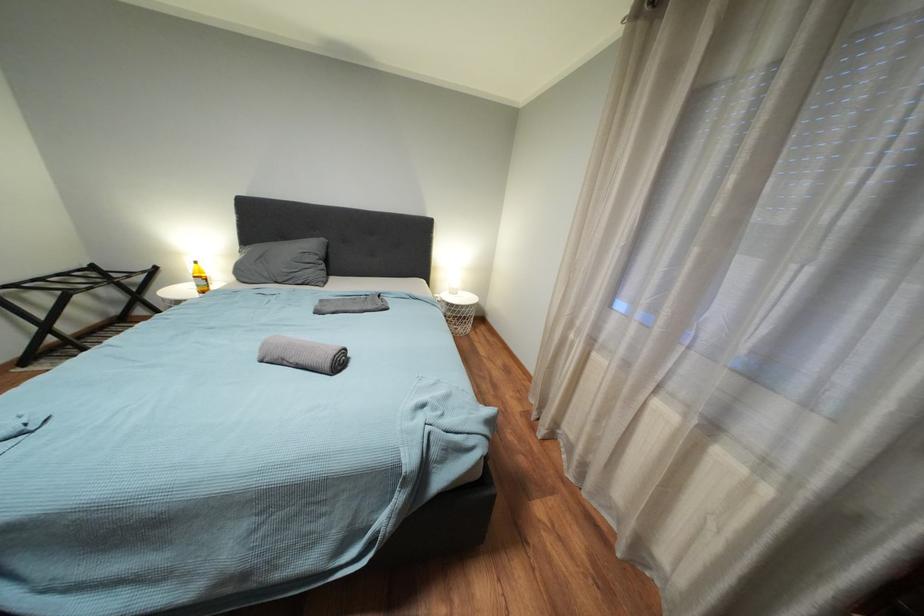
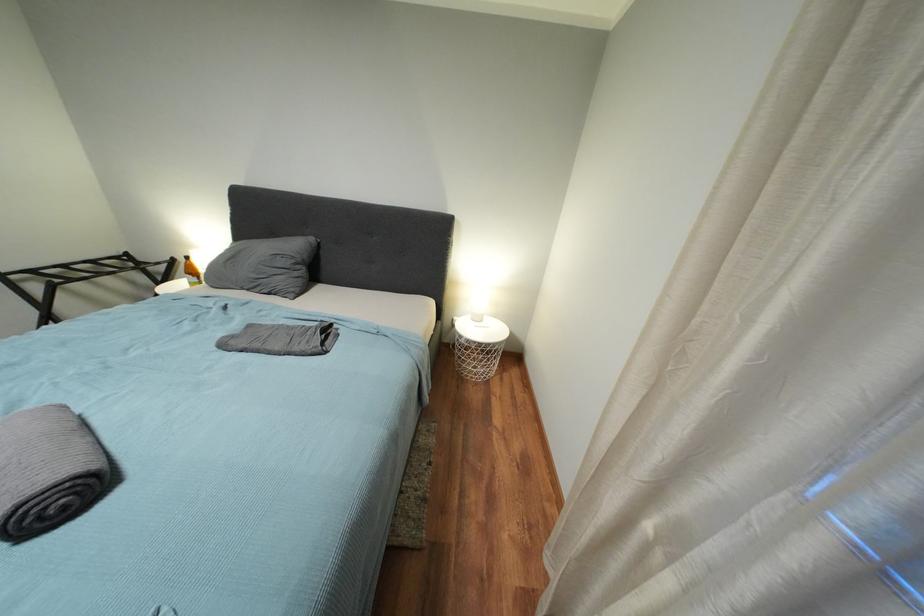
Question: Based on the continuous images, in which direction is the camera rotating? Reply with the corresponding letter.

Choices:
 (A) Left
 (B) Right
 (C) Up
 (D) Down

Answer: (A)